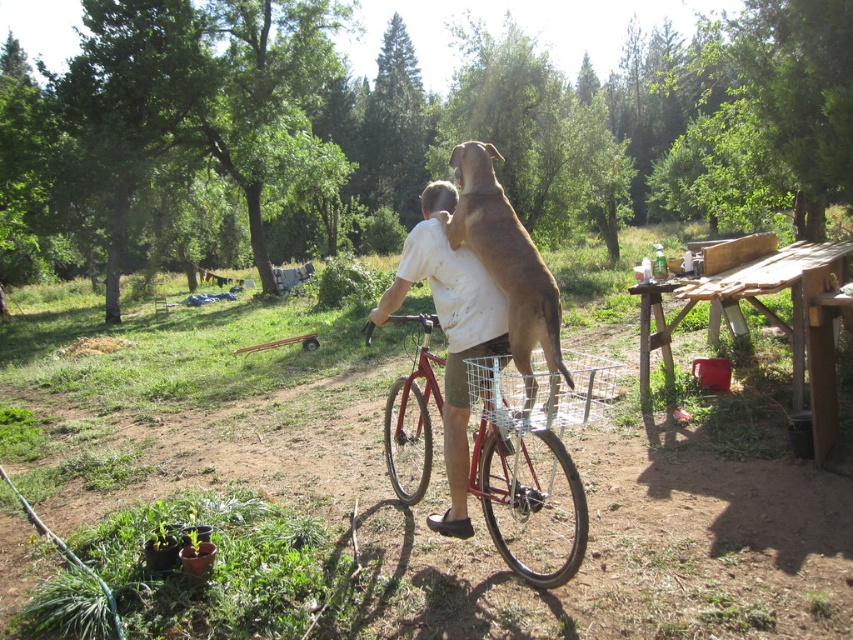
Can you confirm if wooden picnic table at right is positioned below wire mesh basket at center?

No, wooden picnic table at right is not below wire mesh basket at center.

Does wooden picnic table at right appear over wire mesh basket at center?

Yes, wooden picnic table at right is above wire mesh basket at center.

Who is more distant from viewer, (775, 269) or (560, 381)?

The point (775, 269) is more distant.

You are a GUI agent. You are given a task and a screenshot of the screen. Output one action in this format:
    pyautogui.click(x=<x>, y=<y>)
    Task: Click on the wooden picnic table at right
    This screenshot has width=853, height=640.
    Given the screenshot: What is the action you would take?
    pyautogui.click(x=775, y=314)

Is wooden picnic table at right thinner than brown furry dog at upper center?

No.

Is the position of wooden picnic table at right less distant than that of brown furry dog at upper center?

No, it is behind brown furry dog at upper center.

Who is more forward, (749, 253) or (525, 416)?

Point (525, 416) is more forward.

The width and height of the screenshot is (853, 640). I want to click on wooden picnic table at right, so click(x=775, y=314).

Between point (440, 237) and point (390, 396), which one is positioned behind?

The point (390, 396) is behind.

From the picture: Which of these two, white matte shirt at center or metallic red bicycle at center, stands shorter?

Standing shorter between the two is metallic red bicycle at center.

Locate an element on the screen. white matte shirt at center is located at coordinates (450, 332).

Find the location of a particular element. The height and width of the screenshot is (640, 853). white matte shirt at center is located at coordinates (450, 332).